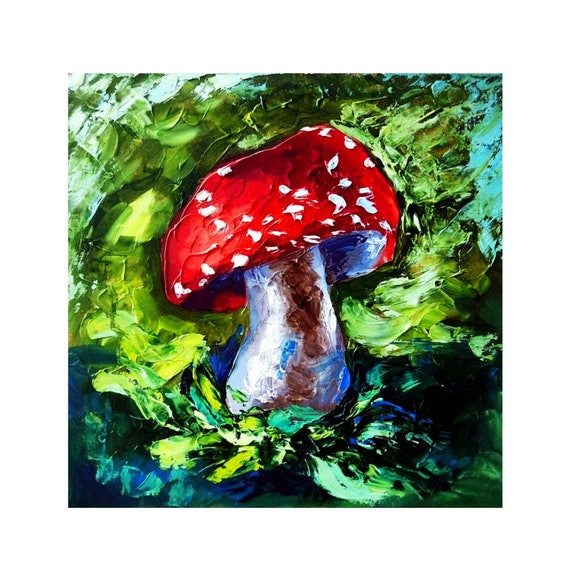
You are a GUI agent. You are given a task and a screenshot of the screen. Output one action in this format:
    pyautogui.click(x=<x>, y=<y>)
    Task: Click on the yellow-green paint strokes
    
    Given the screenshot: What is the action you would take?
    [403, 289], [367, 328], [185, 349], [139, 218], [166, 365], [97, 381], [176, 451], [232, 460], [180, 135]